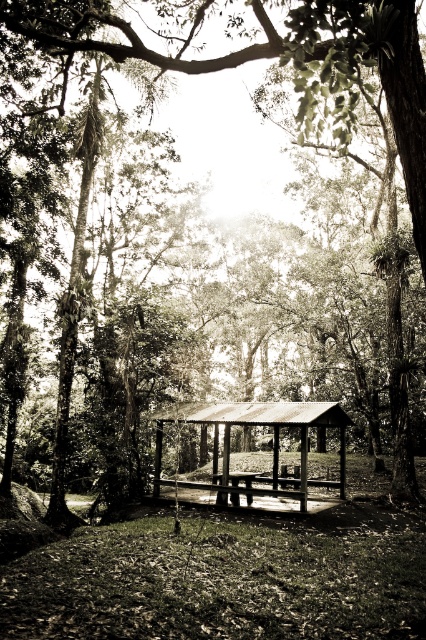
Can you confirm if metallic/grey gazebo at center is smaller than wooden picnic table at center?

Actually, metallic/grey gazebo at center might be larger than wooden picnic table at center.

Between point (313, 417) and point (244, 472), which one is positioned in front?

Point (313, 417) is in front.

Measure the distance between point (x=204, y=436) and camera.

Point (x=204, y=436) is 38.78 meters from camera.

In order to click on metallic/grey gazebo at center in this screenshot , I will do `click(271, 451)`.